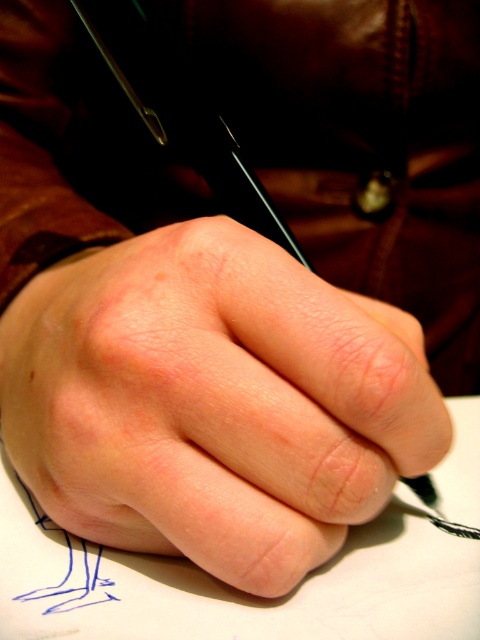
Question: Can you confirm if smooth skin hand at center is positioned to the right of black metallic pencil at center?

Choices:
 (A) no
 (B) yes

Answer: (B)

Question: Which point is farther to the camera?

Choices:
 (A) black metallic pencil at center
 (B) smooth skin hand at center

Answer: (A)

Question: Can you confirm if smooth skin hand at center is thinner than black metallic pencil at center?

Choices:
 (A) no
 (B) yes

Answer: (A)

Question: Which object appears farthest from the camera in this image?

Choices:
 (A) smooth skin hand at center
 (B) black metallic pencil at center

Answer: (B)

Question: Can you confirm if smooth skin hand at center is positioned to the right of black metallic pencil at center?

Choices:
 (A) no
 (B) yes

Answer: (B)

Question: Which point is farther to the camera?

Choices:
 (A) (51, 445)
 (B) (252, 225)

Answer: (B)